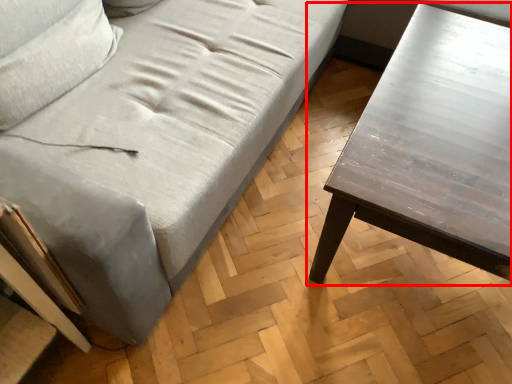
Question: From the image's perspective, where is table (annotated by the red box) located in relation to studio couch in the image?

Choices:
 (A) above
 (B) below

Answer: (B)